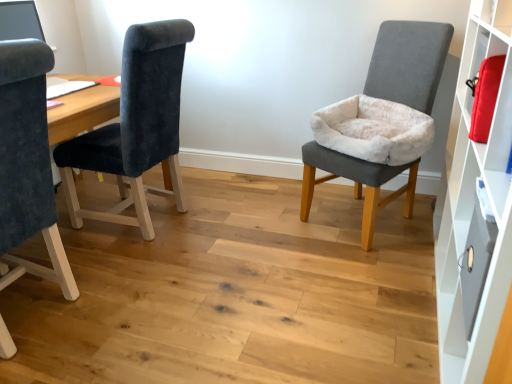
Locate an element on the screen. This screenshot has height=384, width=512. vacant space that's between velvet gray chair at right, the first chair viewed from the right, and velvet dark blue chair at left, the second chair positioned from the left is located at coordinates (263, 220).